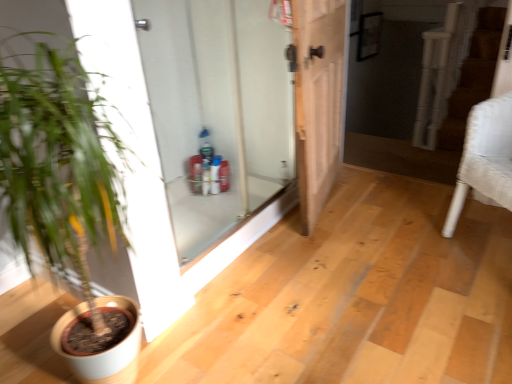
The image size is (512, 384). Identify the location of vacant space in white glass door at center, the second door viewed from the right (from a real-world perspective). (247, 228).